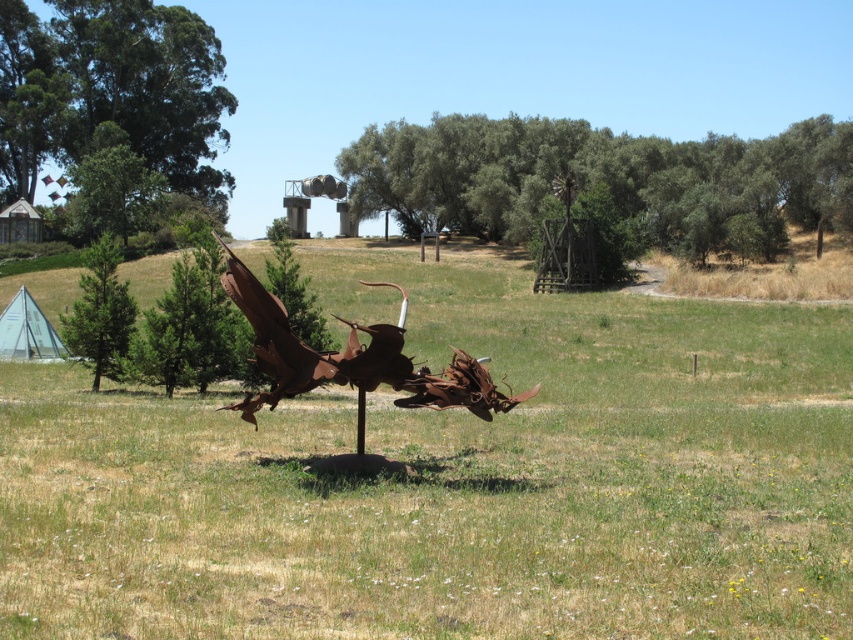
Question: Is green leafy tree at upper center positioned in front of green leafy tree at upper left?

Choices:
 (A) no
 (B) yes

Answer: (B)

Question: Is green leafy tree at upper center to the left of green matte tree at left from the viewer's perspective?

Choices:
 (A) yes
 (B) no

Answer: (B)

Question: Among these objects, which one is nearest to the camera?

Choices:
 (A) rusty metal sculpture at center
 (B) green matte tree at left

Answer: (A)

Question: Does green leafy tree at upper center have a lesser width compared to green matte tree at left?

Choices:
 (A) no
 (B) yes

Answer: (A)

Question: Which object is positioned farthest from the rusty metal dragon at center?

Choices:
 (A) green leafy tree at upper left
 (B) green matte tree at left
 (C) rusty metal sculpture at center
 (D) green leafy tree at upper center

Answer: (A)

Question: Among these points, which one is farthest from the camera?

Choices:
 (A) (224, 220)
 (B) (241, 278)
 (C) (660, 170)
 (D) (123, 308)

Answer: (A)